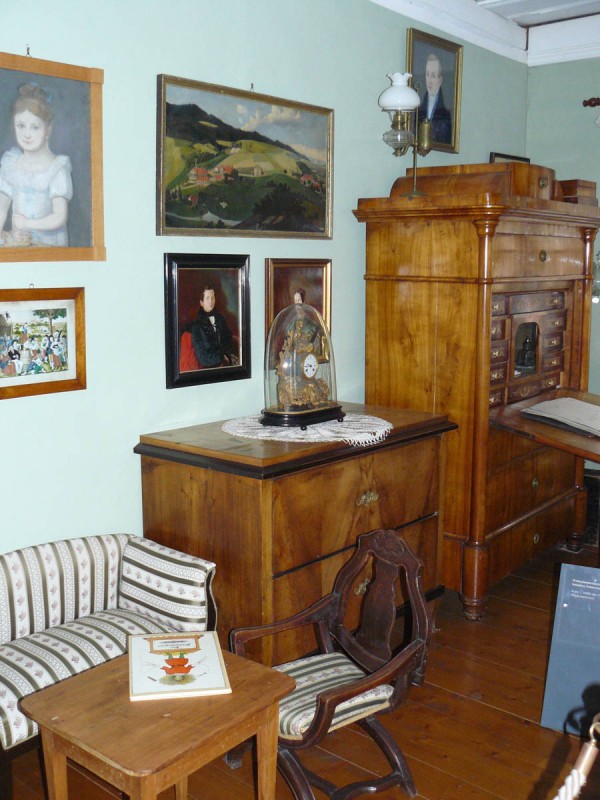
Where is `clock`? This screenshot has width=600, height=800. clock is located at coordinates (302, 360).